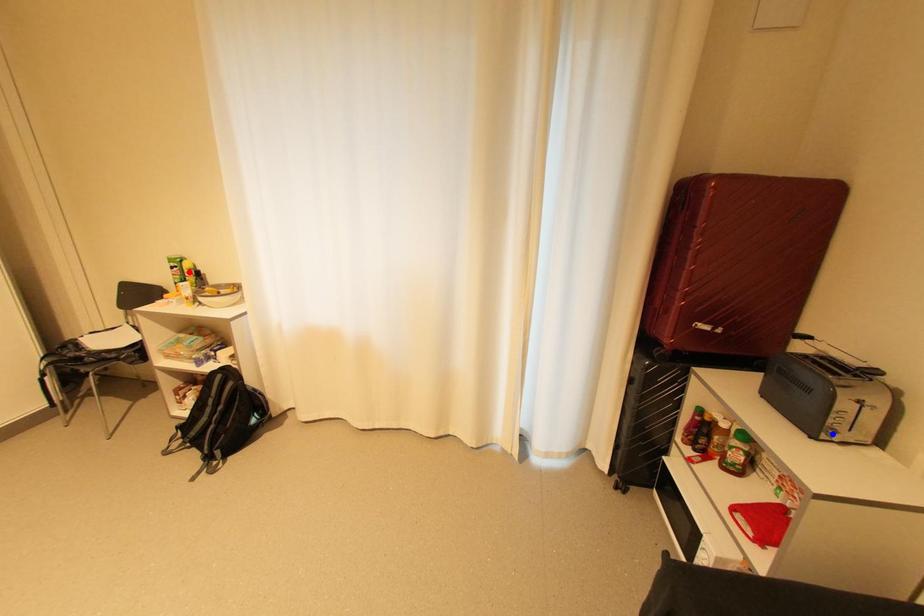
Question: Which of the two points in the image is closer to the camera?

Choices:
 (A) Blue point is closer.
 (B) Red point is closer.

Answer: (A)